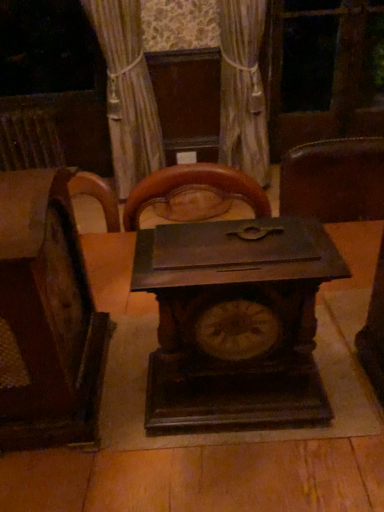
You are a GUI agent. You are given a task and a screenshot of the screen. Output one action in this format:
    pyautogui.click(x=<x>, y=<y>)
    Task: Click on the free space in front of dark brown wood clock at center
    Image resolution: width=384 pixels, height=512 pixels.
    Given the screenshot: What is the action you would take?
    pyautogui.click(x=253, y=467)